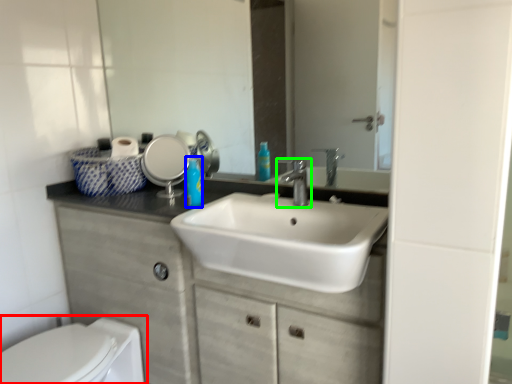
Question: Estimate the real-world distances between objects in this image. Which object is farther from toilet (highlighted by a red box), soap dispenser (highlighted by a blue box) or tap (highlighted by a green box)?

Choices:
 (A) soap dispenser
 (B) tap

Answer: (B)